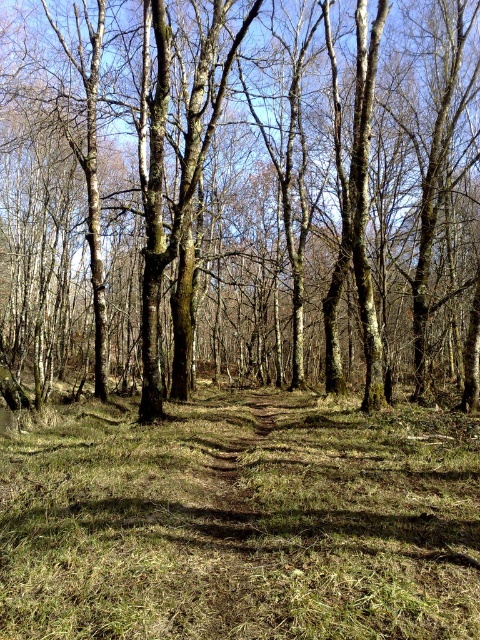
Can you confirm if brown bark tree at center is taller than green grass at center?

Yes.

Does brown bark tree at center come behind green grass at center?

That is True.

Who is more distant from viewer, (103, 74) or (184, 612)?

The point (103, 74) is behind.

Find the location of a particular element. brown bark tree at center is located at coordinates (243, 193).